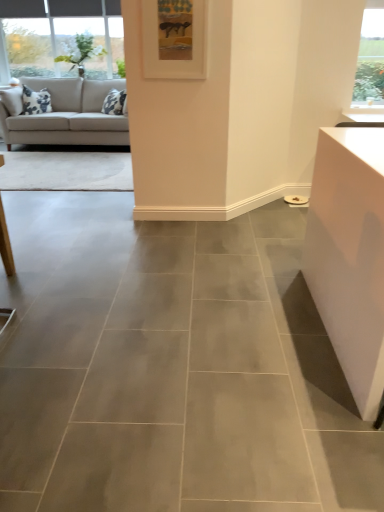
Question: Is beige fabric couch at upper left closer to camera compared to white matte picture frame at upper center?

Choices:
 (A) no
 (B) yes

Answer: (A)

Question: Considering the relative sizes of beige fabric couch at upper left and white matte picture frame at upper center in the image provided, is beige fabric couch at upper left taller than white matte picture frame at upper center?

Choices:
 (A) no
 (B) yes

Answer: (B)

Question: Can you confirm if beige fabric couch at upper left is bigger than white matte picture frame at upper center?

Choices:
 (A) no
 (B) yes

Answer: (B)

Question: From the image's perspective, is beige fabric couch at upper left under white matte picture frame at upper center?

Choices:
 (A) yes
 (B) no

Answer: (B)

Question: Is beige fabric couch at upper left surrounding white matte picture frame at upper center?

Choices:
 (A) yes
 (B) no

Answer: (B)

Question: Is beige fabric couch at upper left next to white matte picture frame at upper center?

Choices:
 (A) no
 (B) yes

Answer: (A)

Question: Is white matte picture frame at upper center shorter than beige fabric couch at upper left?

Choices:
 (A) no
 (B) yes

Answer: (B)

Question: From a real-world perspective, is white matte picture frame at upper center located beneath beige fabric couch at upper left?

Choices:
 (A) yes
 (B) no

Answer: (B)

Question: Is white matte picture frame at upper center closer to camera compared to beige fabric couch at upper left?

Choices:
 (A) yes
 (B) no

Answer: (A)

Question: Can you confirm if white matte picture frame at upper center is positioned to the left of beige fabric couch at upper left?

Choices:
 (A) yes
 (B) no

Answer: (B)

Question: Can you confirm if white matte picture frame at upper center is smaller than beige fabric couch at upper left?

Choices:
 (A) no
 (B) yes

Answer: (B)

Question: Can you confirm if white matte picture frame at upper center is taller than beige fabric couch at upper left?

Choices:
 (A) yes
 (B) no

Answer: (B)

Question: Is white matte picture frame at upper center in front of or behind beige fabric couch at upper left in the image?

Choices:
 (A) front
 (B) behind

Answer: (A)